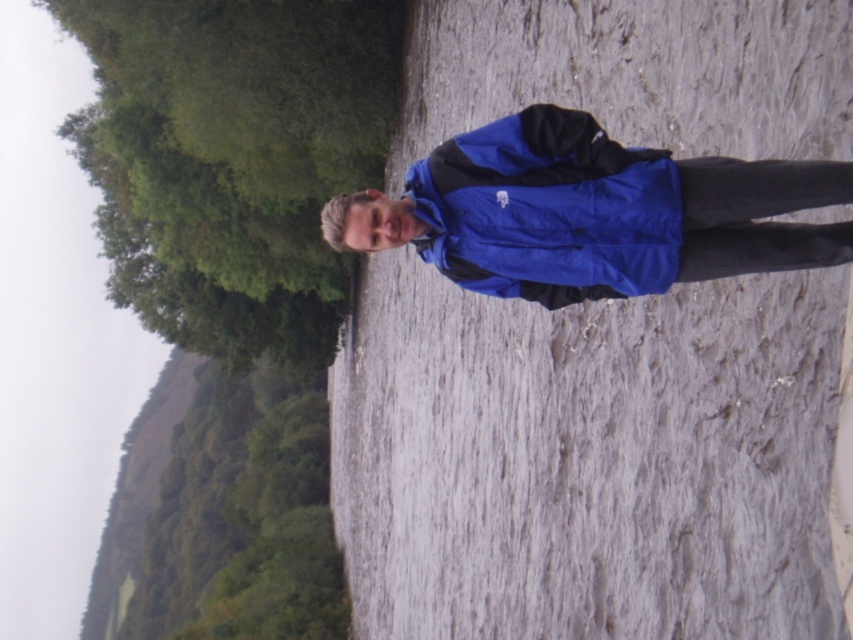
Is point (566, 44) farther from viewer compared to point (469, 269)?

Yes, point (566, 44) is farther from viewer.

How much distance is there between blue fabric jacket at center and blue synthetic jacket at center?

A distance of 15.75 meters exists between blue fabric jacket at center and blue synthetic jacket at center.

This screenshot has height=640, width=853. In order to click on blue fabric jacket at center in this screenshot , I will do `click(589, 460)`.